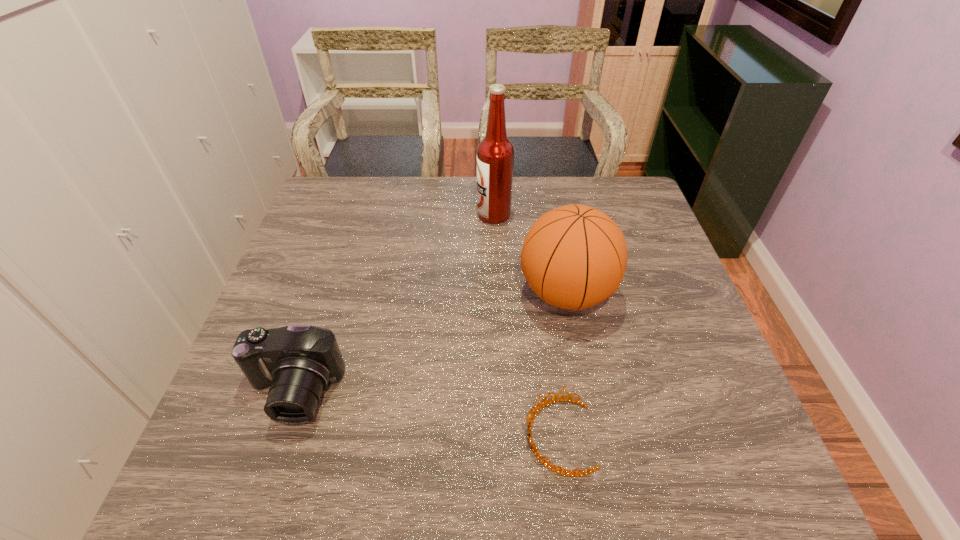
I want to click on vacant point located on the front of the second farthest object, so click(589, 419).

At what (x,y) coordinates should I click in order to perform the action: click on blank space located 0.080m on the lens of the second shortest object. Please return your answer as a coordinate pair (x, y). The height and width of the screenshot is (540, 960). Looking at the image, I should click on (269, 468).

Locate an element on the screen. This screenshot has width=960, height=540. free space located 0.060m on the front-facing side of the shortest object is located at coordinates (492, 436).

Locate an element on the screen. vacant point located on the front-facing side of the shortest object is located at coordinates (416, 436).

In order to click on vacant space located 0.390m on the front-facing side of the shortest object in this screenshot , I will do (323, 436).

Find the location of a particular element. The height and width of the screenshot is (540, 960). object present at the far edge is located at coordinates (495, 153).

This screenshot has width=960, height=540. Find the location of `object that is at the near edge`. object that is at the near edge is located at coordinates (530, 419).

Image resolution: width=960 pixels, height=540 pixels. Find the location of `object present at the left edge`. object present at the left edge is located at coordinates (298, 362).

Locate an element on the screen. free region at the far edge of the desktop is located at coordinates (549, 176).

Identify the location of blank space at the near edge of the desktop. The image size is (960, 540). (446, 458).